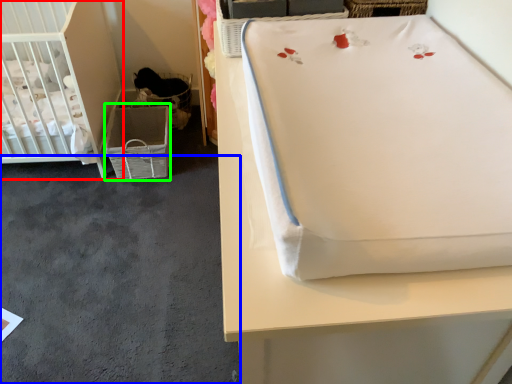
Question: Based on their relative distances, which object is nearer to infant bed (highlighted by a red box)? Choose from concrete (highlighted by a blue box) and crate (highlighted by a green box).

Choices:
 (A) concrete
 (B) crate

Answer: (B)